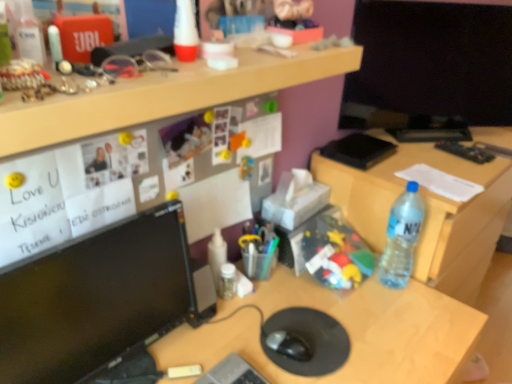
Find the location of a particular element. This screenshot has height=384, width=512. vacant region to the left of black matte mouse at center is located at coordinates (227, 340).